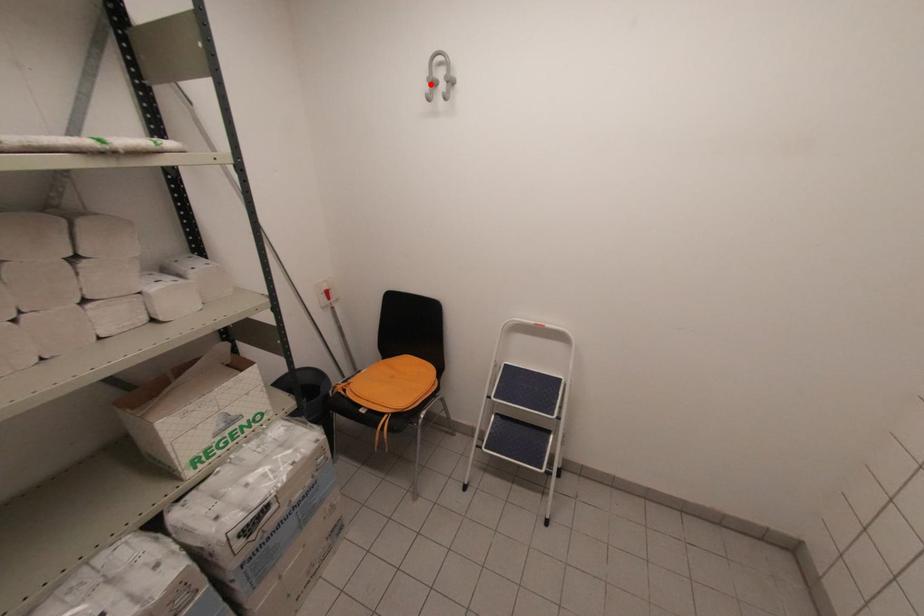
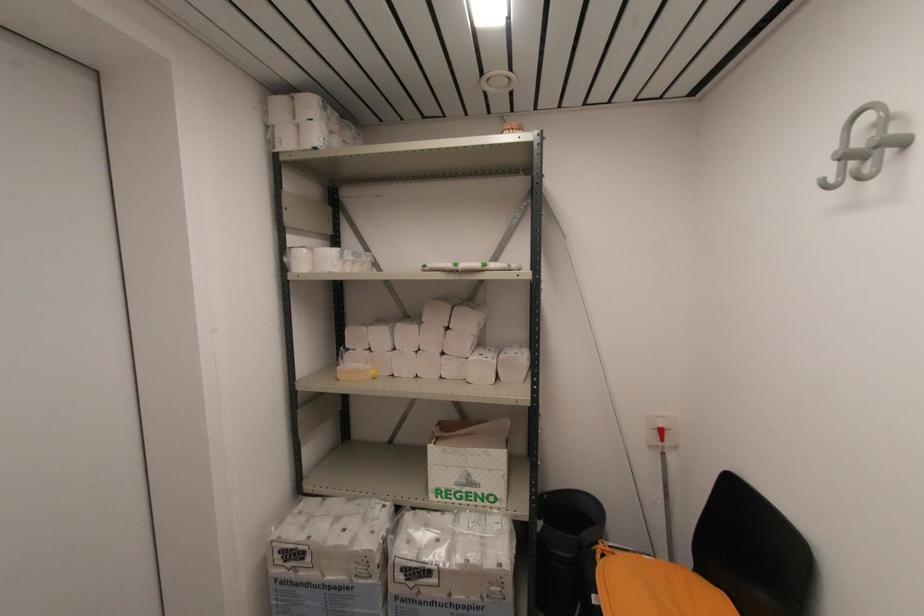
In the second image, find the point that corresponds to the highlighted location in the first image.

(843, 160)